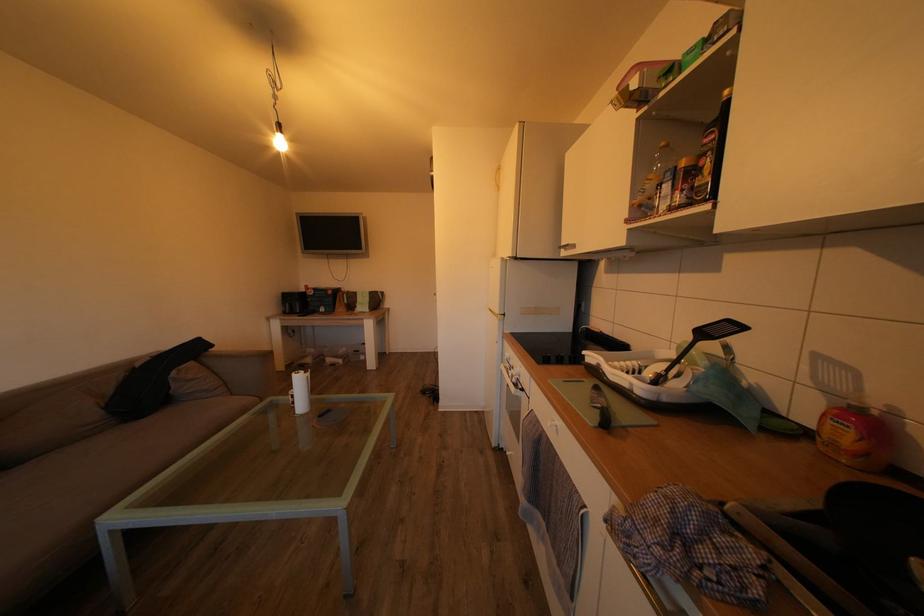
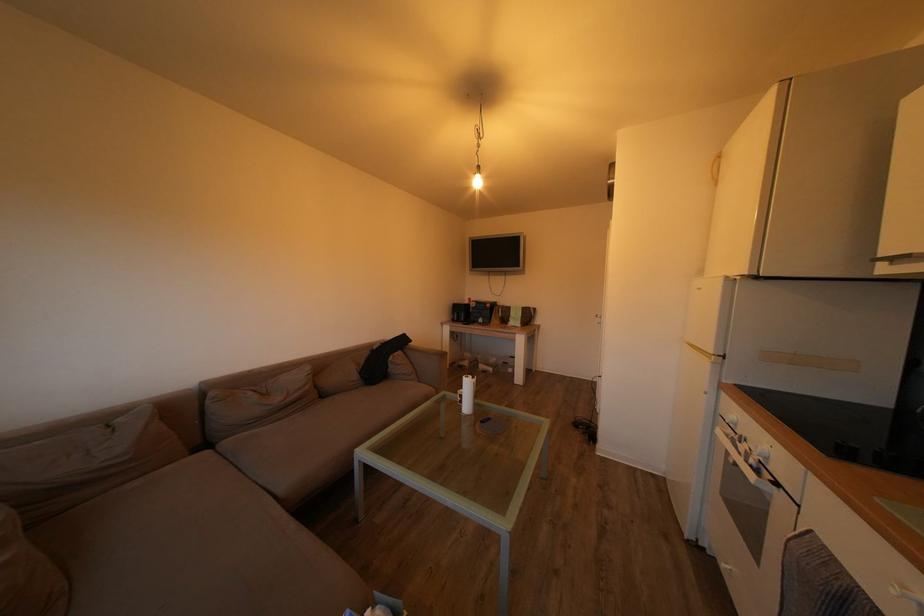
Find the pixel in the second image that matches point (102, 419) in the first image.

(362, 382)